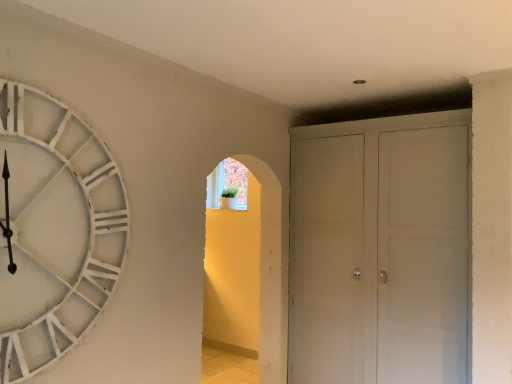
Question: Can you confirm if white wooden clock at left is wider than white matte cabinet at right?

Choices:
 (A) no
 (B) yes

Answer: (A)

Question: Does white wooden clock at left have a lesser height compared to white matte cabinet at right?

Choices:
 (A) yes
 (B) no

Answer: (A)

Question: Considering the relative positions of white wooden clock at left and white matte cabinet at right in the image provided, is white wooden clock at left to the right of white matte cabinet at right from the viewer's perspective?

Choices:
 (A) yes
 (B) no

Answer: (B)

Question: From a real-world perspective, is white wooden clock at left positioned over white matte cabinet at right based on gravity?

Choices:
 (A) no
 (B) yes

Answer: (B)

Question: Does white wooden clock at left have a lesser width compared to white matte cabinet at right?

Choices:
 (A) no
 (B) yes

Answer: (B)

Question: From the image's perspective, is white wooden clock at left beneath white matte cabinet at right?

Choices:
 (A) yes
 (B) no

Answer: (B)

Question: Is white matte cabinet at right in front of white wooden clock at left?

Choices:
 (A) yes
 (B) no

Answer: (B)

Question: Is white matte cabinet at right positioned beyond the bounds of white wooden clock at left?

Choices:
 (A) yes
 (B) no

Answer: (A)

Question: From the image's perspective, would you say white matte cabinet at right is shown under white wooden clock at left?

Choices:
 (A) yes
 (B) no

Answer: (A)

Question: Is white matte cabinet at right wider than white wooden clock at left?

Choices:
 (A) no
 (B) yes

Answer: (B)

Question: From a real-world perspective, is white matte cabinet at right on white wooden clock at left?

Choices:
 (A) no
 (B) yes

Answer: (A)

Question: Would you say white matte cabinet at right is a long distance from white wooden clock at left?

Choices:
 (A) no
 (B) yes

Answer: (B)

Question: Considering the positions of white matte cabinet at right and white wooden clock at left in the image, is white matte cabinet at right bigger or smaller than white wooden clock at left?

Choices:
 (A) big
 (B) small

Answer: (A)